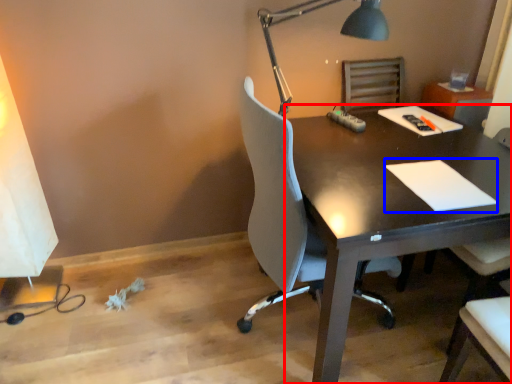
Question: Which object appears farthest to the camera in this image, desk (highlighted by a red box) or notepad (highlighted by a blue box)?

Choices:
 (A) desk
 (B) notepad

Answer: (B)